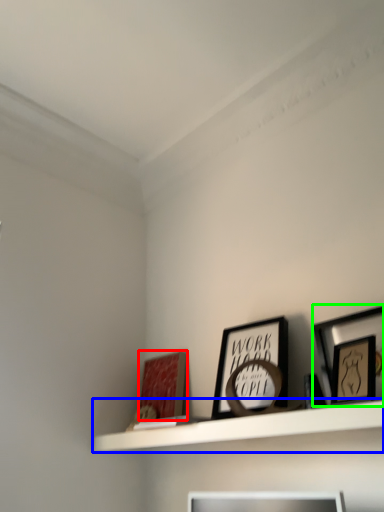
Question: Which is farther away from picture frame (highlighted by a red box)? shelf (highlighted by a blue box) or picture frame (highlighted by a green box)?

Choices:
 (A) shelf
 (B) picture frame

Answer: (B)